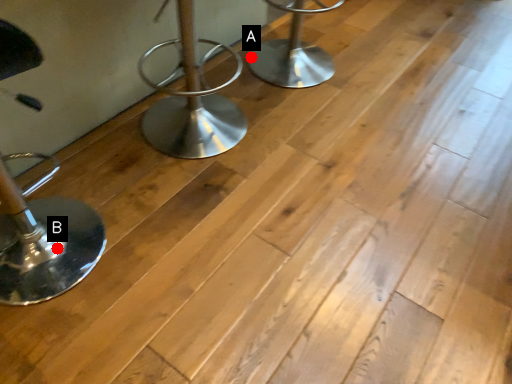
Question: Two points are circled on the image, labeled by A and B beside each circle. Which point appears closest to the camera in this image?

Choices:
 (A) A is closer
 (B) B is closer

Answer: (B)